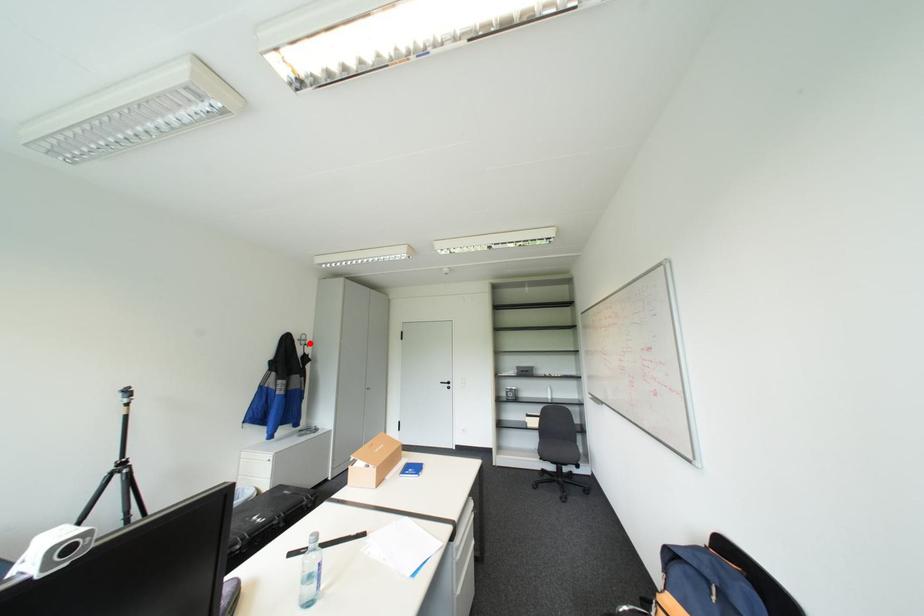
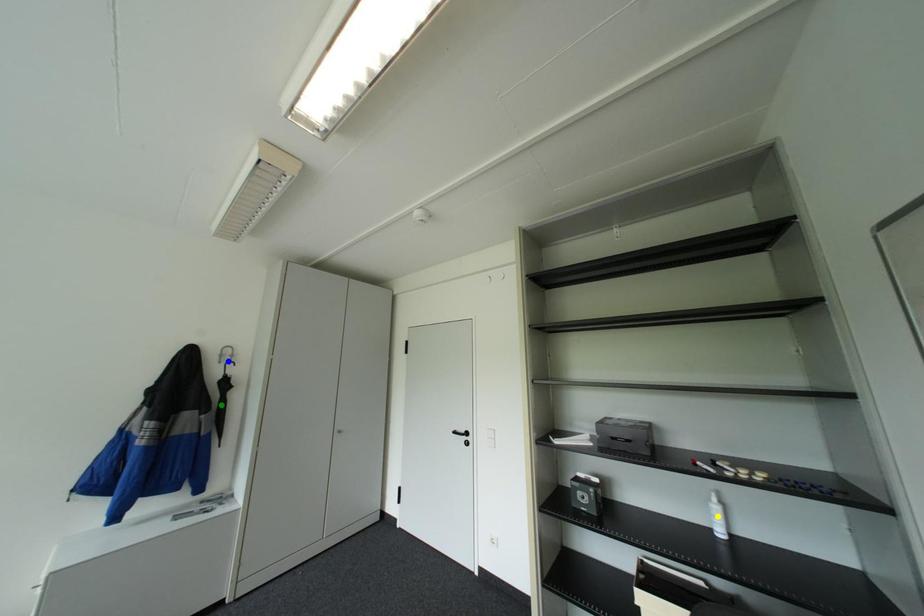
Question: I am providing you with two images of the same scene from different viewpoints. A red point is marked on the first image. You are given multiple points on the second image. Which point in image 2 is actually the same real-world point as the red point in image 1?

Choices:
 (A) green point
 (B) yellow point
 (C) blue point

Answer: (C)